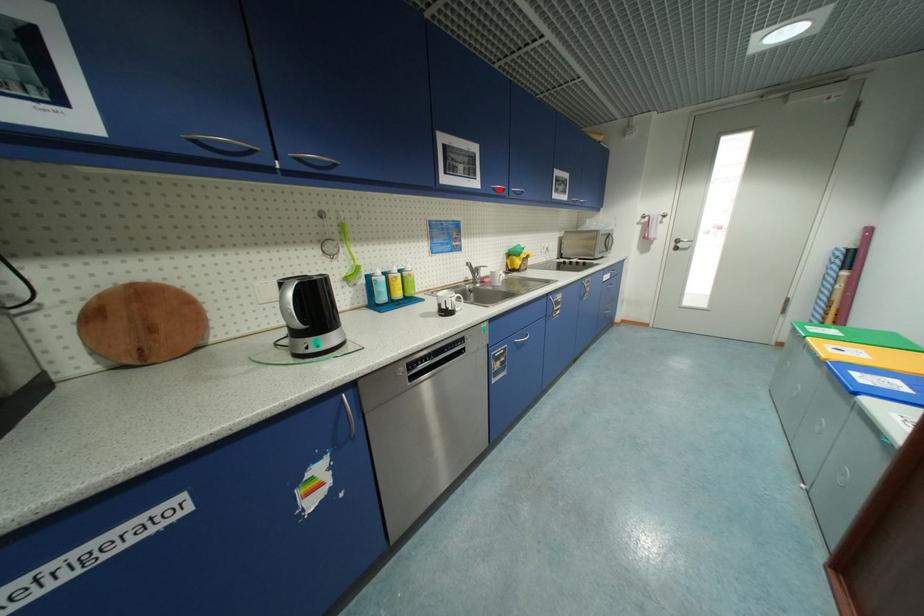
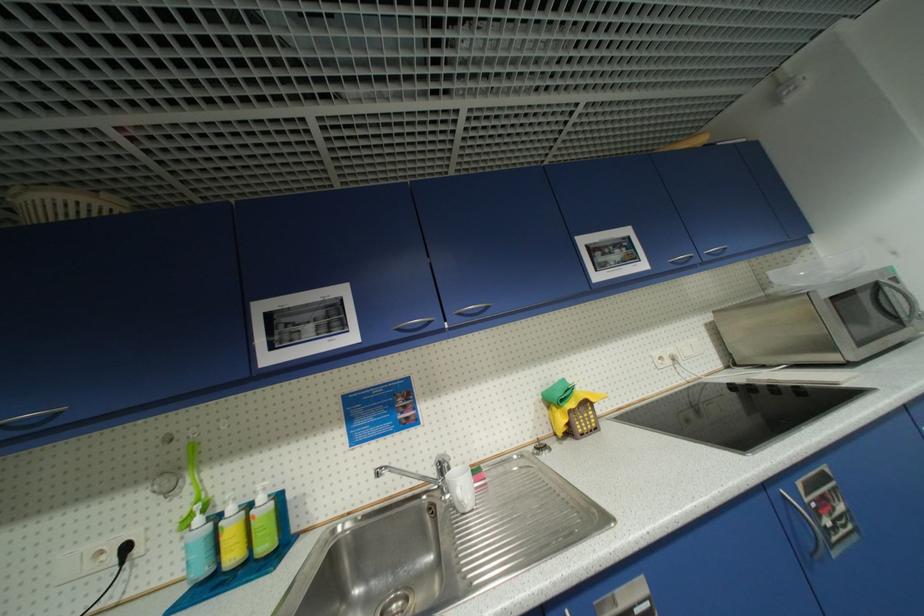
Locate, in the second image, the point that corresponds to the highlighted location in the first image.

(405, 331)